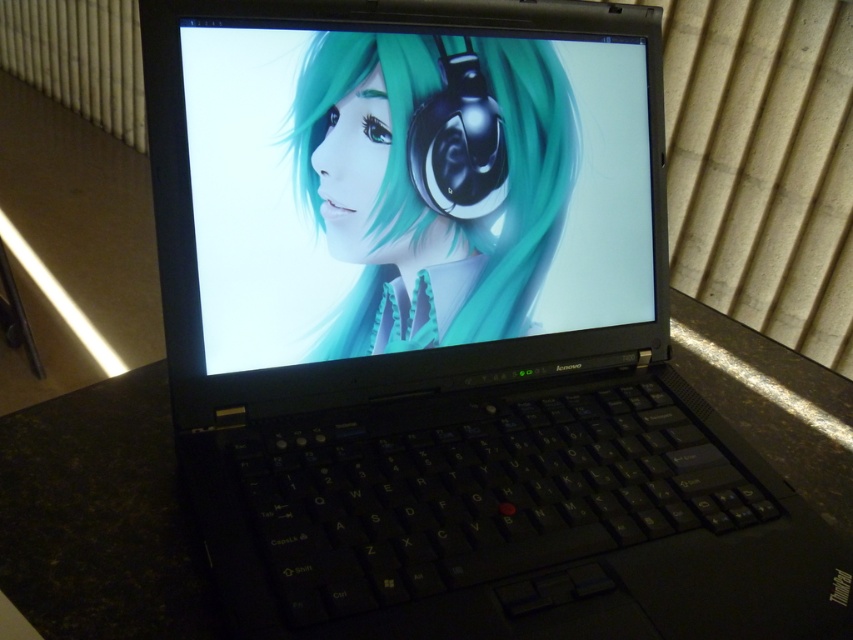
Question: Is black matte table at center to the right of black glossy earphone at center from the viewer's perspective?

Choices:
 (A) yes
 (B) no

Answer: (A)

Question: Which object is farther from the camera taking this photo?

Choices:
 (A) matte black screen at center
 (B) black glossy earphone at center

Answer: (B)

Question: Which point is closer to the camera?

Choices:
 (A) (692, 305)
 (B) (596, 147)

Answer: (B)

Question: Is matte black screen at center further to camera compared to black glossy earphone at center?

Choices:
 (A) no
 (B) yes

Answer: (A)

Question: Among these points, which one is farthest from the camera?

Choices:
 (A) (149, 616)
 (B) (422, 148)
 (C) (292, 99)

Answer: (B)

Question: Does black matte table at center have a larger size compared to black glossy earphone at center?

Choices:
 (A) yes
 (B) no

Answer: (A)